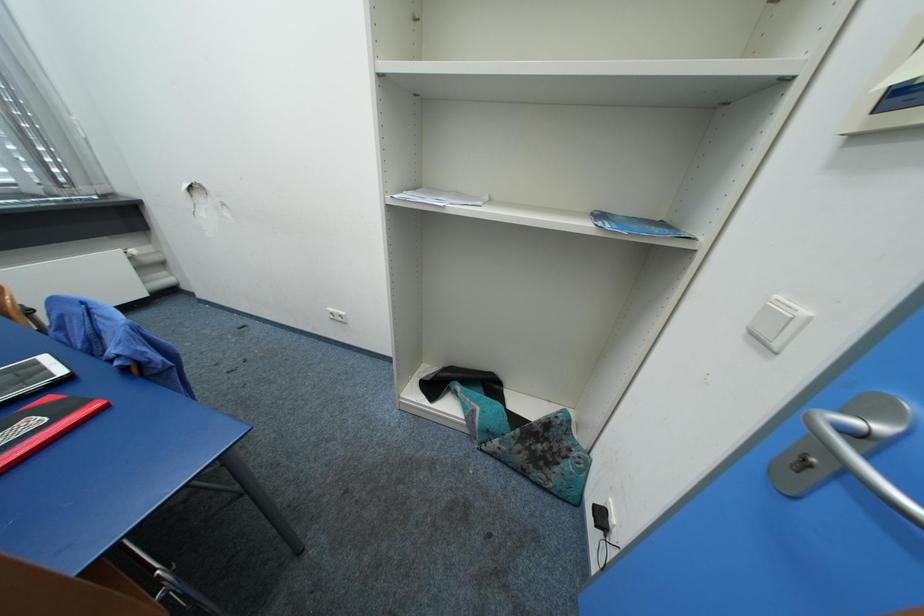
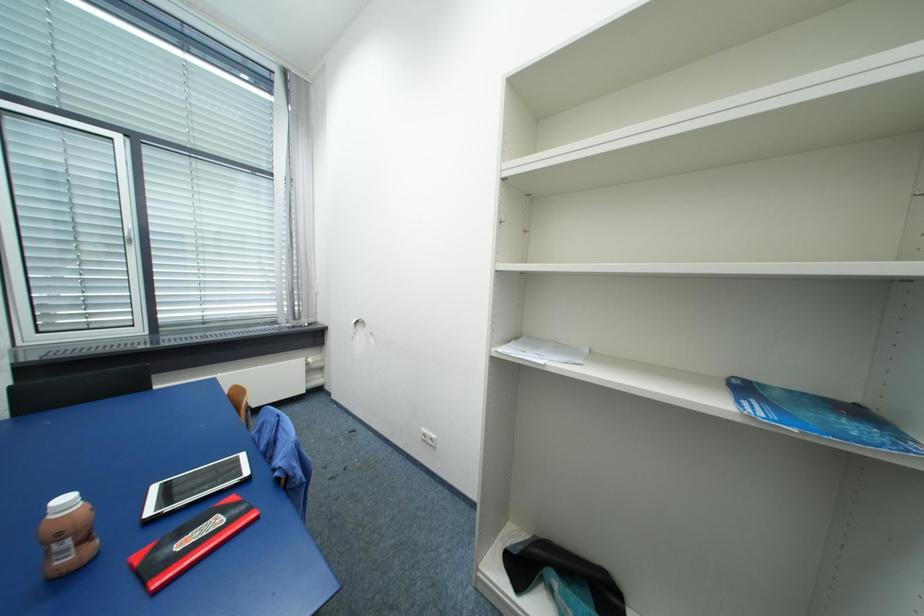
The first image is from the beginning of the video and the second image is from the end. How did the camera likely rotate when shooting the video?

The rotation direction of the camera is left-up.